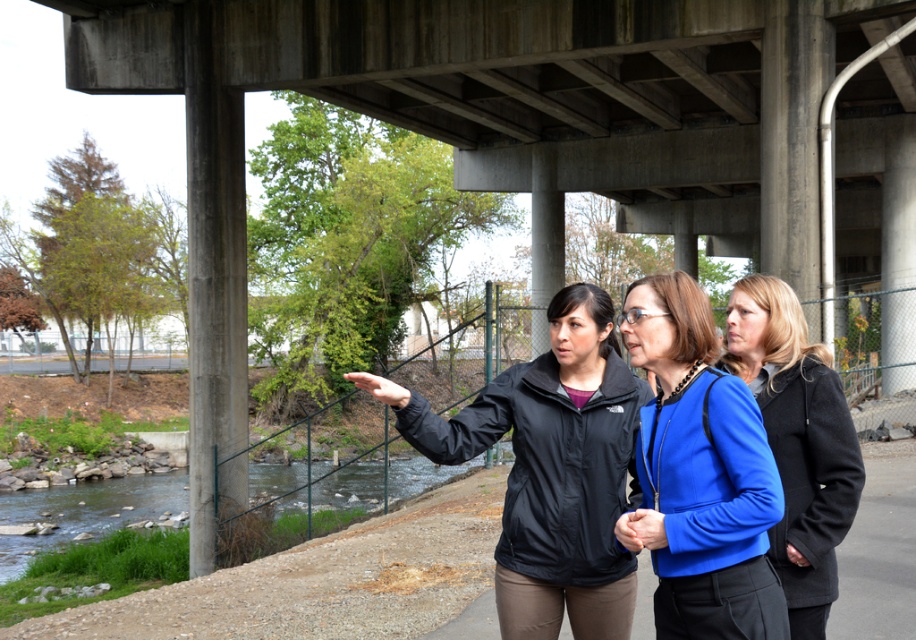
Question: Considering the relative positions of black matte jacket at center and clear water at lower left in the image provided, where is black matte jacket at center located with respect to clear water at lower left?

Choices:
 (A) above
 (B) below

Answer: (A)

Question: Which point is farther to the camera?

Choices:
 (A) (841, 513)
 (B) (771, 595)

Answer: (A)

Question: Is black matte jacket at center bigger than blue fabric jacket at center?

Choices:
 (A) no
 (B) yes

Answer: (B)

Question: Which object appears farthest from the camera in this image?

Choices:
 (A) blue matte jacket at center
 (B) clear water at lower left
 (C) black matte jacket at center

Answer: (B)

Question: Is black matte jacket at center to the right of blue fabric jacket at center from the viewer's perspective?

Choices:
 (A) yes
 (B) no

Answer: (B)

Question: Which of the following is the farthest from the observer?

Choices:
 (A) blue fabric jacket at center
 (B) clear water at lower left
 (C) blue matte jacket at center

Answer: (B)